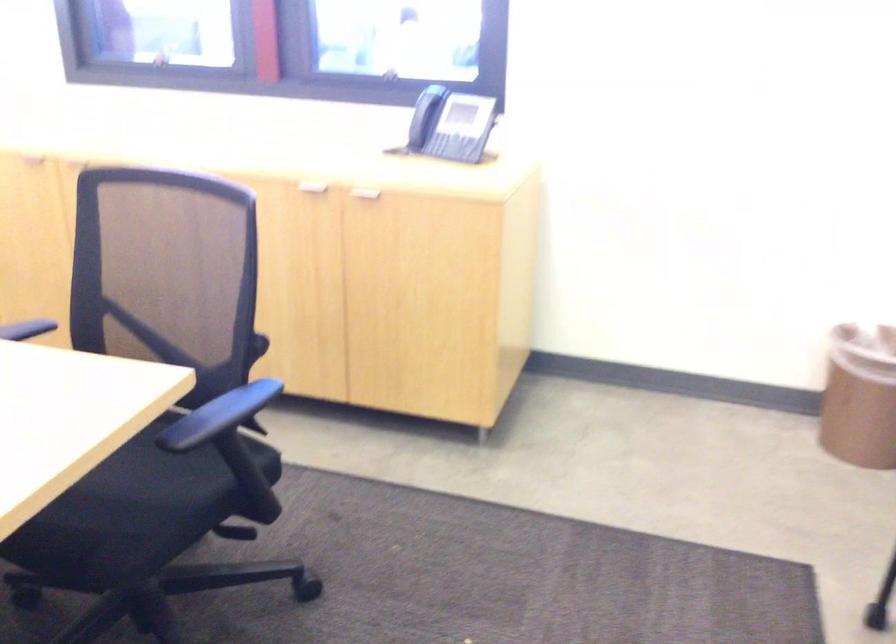
What do you see at coordinates (421, 118) in the screenshot?
I see `a telephone handset` at bounding box center [421, 118].